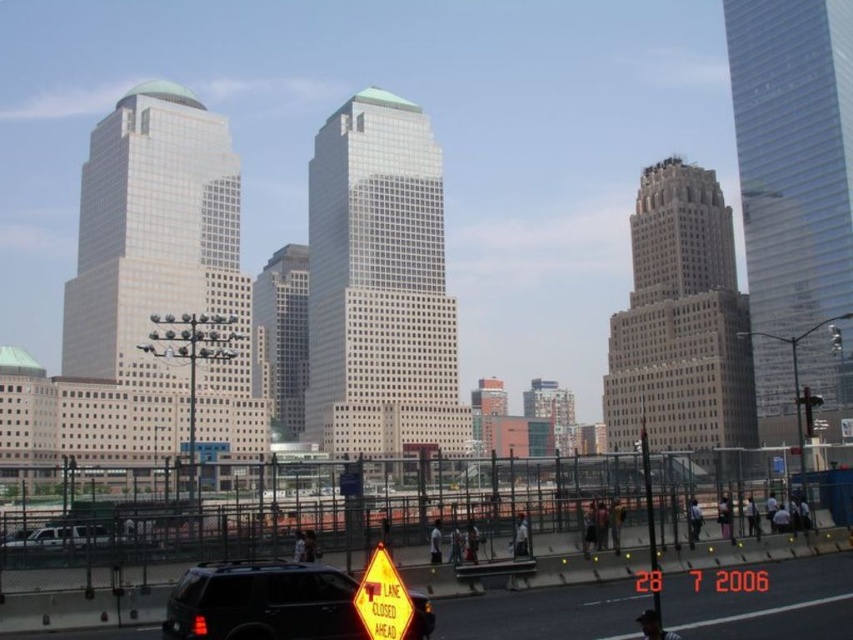
Which is in front, point (169, 595) or point (383, 582)?

Point (383, 582)

Is black matte suv at lower left closer to camera compared to yellow reflective plastic traffic sign at lower center?

No, black matte suv at lower left is behind yellow reflective plastic traffic sign at lower center.

This screenshot has height=640, width=853. Describe the element at coordinates (262, 602) in the screenshot. I see `black matte suv at lower left` at that location.

Image resolution: width=853 pixels, height=640 pixels. What are the coordinates of `black matte suv at lower left` in the screenshot? It's located at click(x=262, y=602).

From the picture: Who is higher up, yellow reflective plastic traffic sign at lower center or silver metallic suv at lower left?

Positioned higher is silver metallic suv at lower left.

Does point (354, 602) come in front of point (76, 545)?

That is True.

Locate an element on the screen. Image resolution: width=853 pixels, height=640 pixels. yellow reflective plastic traffic sign at lower center is located at coordinates (381, 598).

Is black matte suv at lower left bigger than silver metallic suv at lower left?

Yes.

Can you confirm if black matte suv at lower left is smaller than silver metallic suv at lower left?

No, black matte suv at lower left is not smaller than silver metallic suv at lower left.

Between point (335, 573) and point (47, 541), which one is positioned behind?

Positioned behind is point (47, 541).

The height and width of the screenshot is (640, 853). Identify the location of black matte suv at lower left. (262, 602).